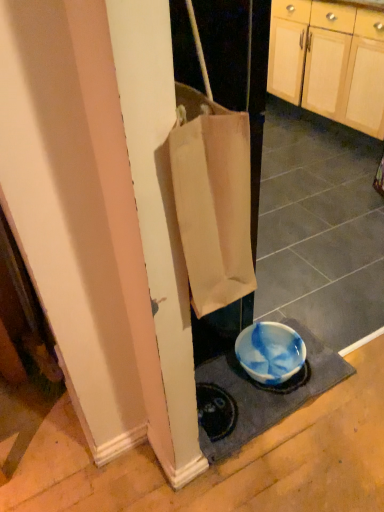
What do you see at coordinates (329, 61) in the screenshot?
I see `light wood cabinets at upper right` at bounding box center [329, 61].

Image resolution: width=384 pixels, height=512 pixels. In order to click on light wood cabinets at upper right in this screenshot , I will do `click(329, 61)`.

The width and height of the screenshot is (384, 512). Identify the location of light wood cabinets at upper right. (329, 61).